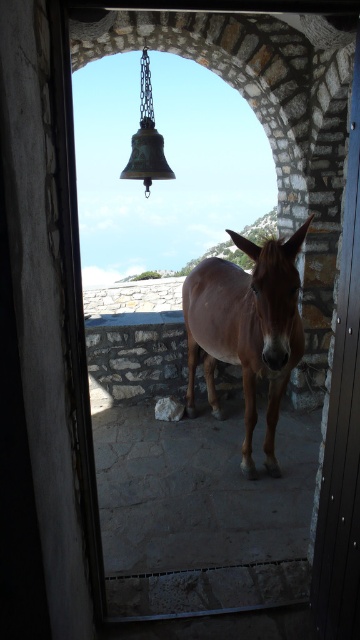
Question: Can you confirm if brown matte mule at center is positioned above metallic gray door at center?

Choices:
 (A) no
 (B) yes

Answer: (A)

Question: Does brown matte mule at center have a smaller size compared to metallic gray door at center?

Choices:
 (A) yes
 (B) no

Answer: (B)

Question: Which of the following is the closest to the observer?

Choices:
 (A) (351, 563)
 (B) (259, 300)

Answer: (A)

Question: Is brown matte mule at center below metallic gray door at center?

Choices:
 (A) no
 (B) yes

Answer: (B)

Question: Which object is closer to the camera taking this photo?

Choices:
 (A) metallic gray door at center
 (B) brown matte mule at center

Answer: (A)

Question: Which object appears closest to the camera in this image?

Choices:
 (A) metallic gray door at center
 (B) brown matte mule at center

Answer: (A)